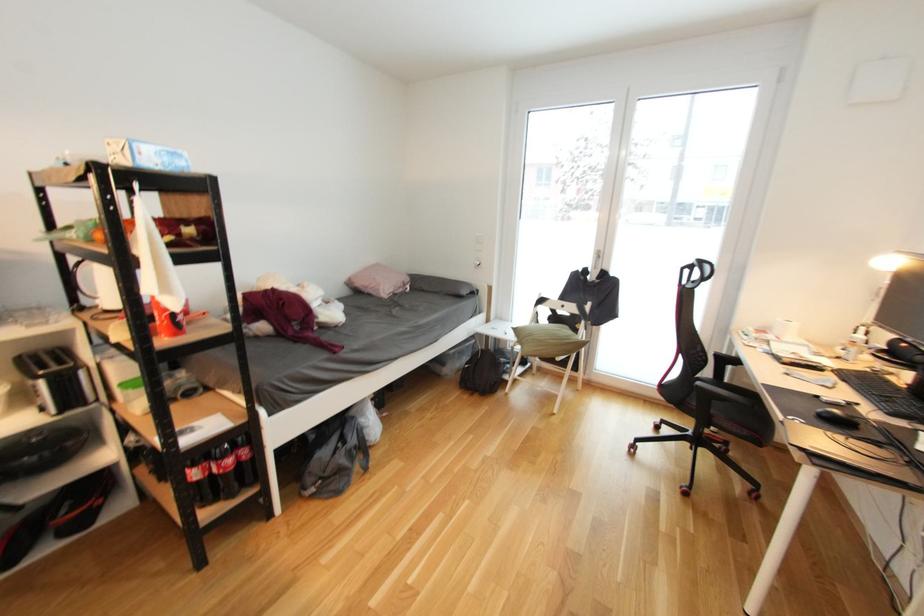
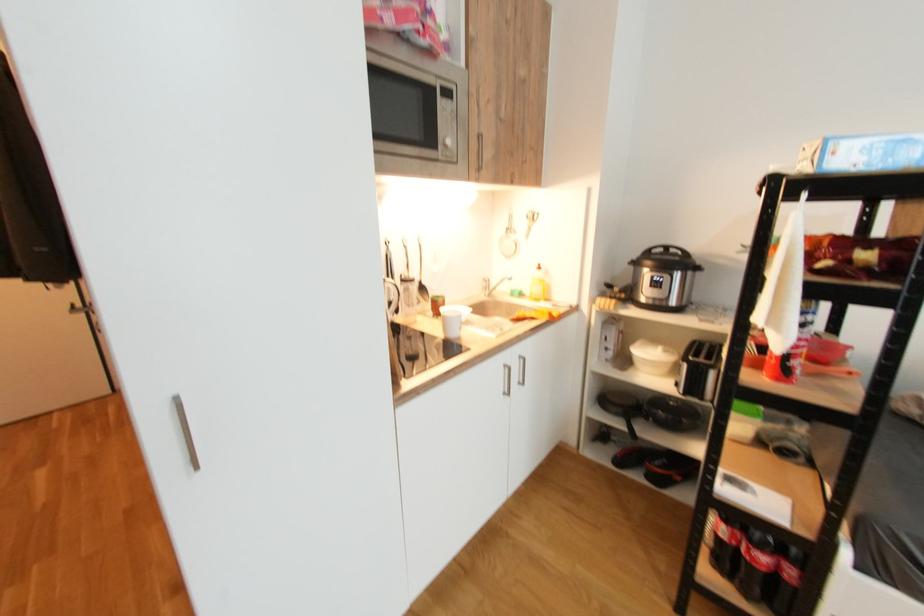
Based on the continuous images, in which direction is the camera rotating?

The camera's rotation is toward left-down.